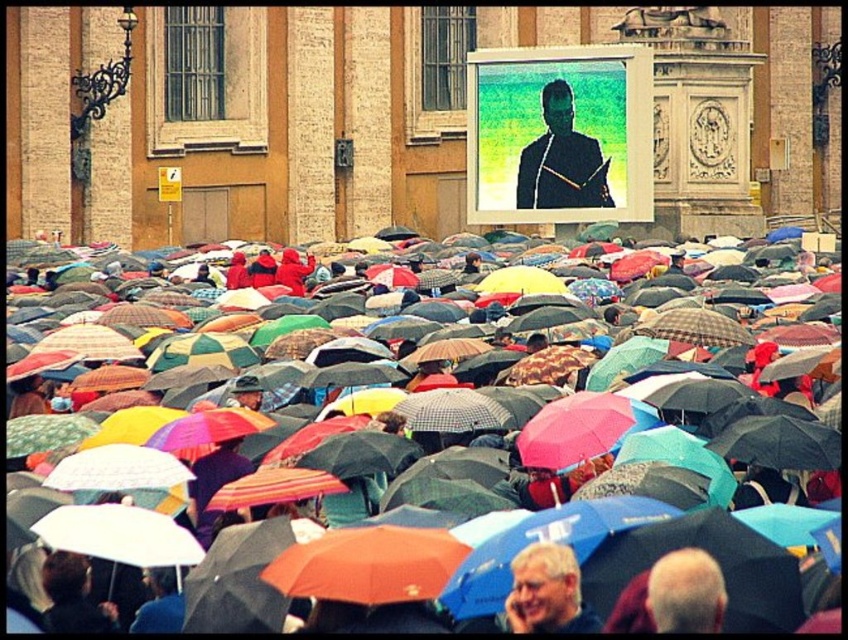
Is point (712, 428) less distant than point (523, 595)?

No, it is not.

Image resolution: width=848 pixels, height=640 pixels. Identify the location of matte black umbrella at center. (640, 372).

Where is `matte black umbrella at center`? Image resolution: width=848 pixels, height=640 pixels. matte black umbrella at center is located at coordinates (640, 372).